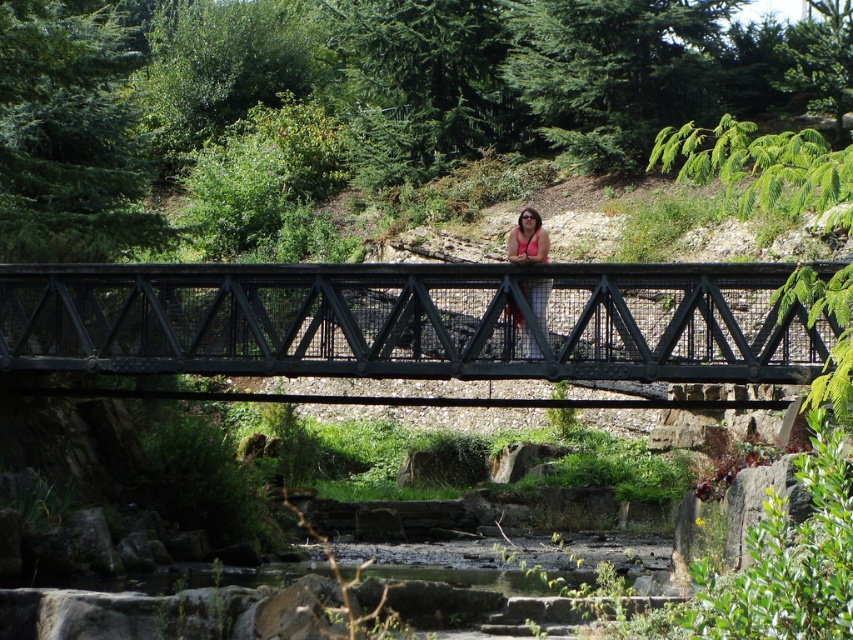
You are a hiker carrying a pink fabric at center and want to cross the black metal footbridge at center. Can you safely place the pink fabric on the bridge without it touching the ground?

The black metal footbridge at center and pink fabric at center are 12.40 feet apart. Since the distance between them is significant, you would need to move closer to place the fabric on the bridge. The current distance makes it impossible to do so without moving.